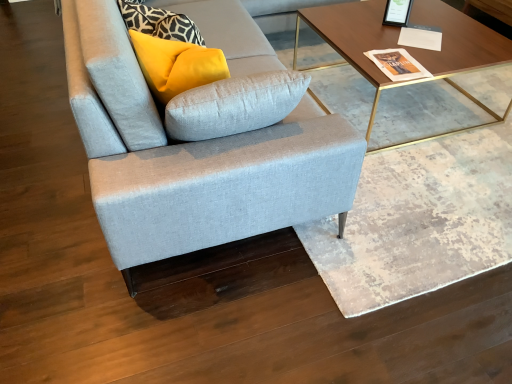
Question: Can you confirm if light gray fabric couch at center is taller than wooden/golden metal legs coffee table at upper right?

Choices:
 (A) yes
 (B) no

Answer: (A)

Question: Is light gray fabric couch at center facing towards wooden/golden metal legs coffee table at upper right?

Choices:
 (A) no
 (B) yes

Answer: (B)

Question: From the image's perspective, does light gray fabric couch at center appear lower than wooden/golden metal legs coffee table at upper right?

Choices:
 (A) yes
 (B) no

Answer: (A)

Question: Is light gray fabric couch at center to the right of wooden/golden metal legs coffee table at upper right from the viewer's perspective?

Choices:
 (A) yes
 (B) no

Answer: (B)

Question: Can you confirm if light gray fabric couch at center is bigger than wooden/golden metal legs coffee table at upper right?

Choices:
 (A) yes
 (B) no

Answer: (A)

Question: From a real-world perspective, is light gray fabric couch at center on top of wooden/golden metal legs coffee table at upper right?

Choices:
 (A) no
 (B) yes

Answer: (B)

Question: Is wooden/golden metal legs coffee table at upper right beside light gray fabric couch at center?

Choices:
 (A) yes
 (B) no

Answer: (B)

Question: Is the position of wooden/golden metal legs coffee table at upper right less distant than that of light gray fabric couch at center?

Choices:
 (A) yes
 (B) no

Answer: (B)

Question: Considering the relative sizes of wooden/golden metal legs coffee table at upper right and light gray fabric couch at center in the image provided, is wooden/golden metal legs coffee table at upper right shorter than light gray fabric couch at center?

Choices:
 (A) yes
 (B) no

Answer: (A)

Question: Is there a large distance between wooden/golden metal legs coffee table at upper right and light gray fabric couch at center?

Choices:
 (A) no
 (B) yes

Answer: (A)

Question: Can you confirm if wooden/golden metal legs coffee table at upper right is taller than light gray fabric couch at center?

Choices:
 (A) yes
 (B) no

Answer: (B)

Question: Is wooden/golden metal legs coffee table at upper right turned away from light gray fabric couch at center?

Choices:
 (A) no
 (B) yes

Answer: (B)

Question: Is matte yellow pillow at upper left bigger than light gray fabric couch at center?

Choices:
 (A) no
 (B) yes

Answer: (A)